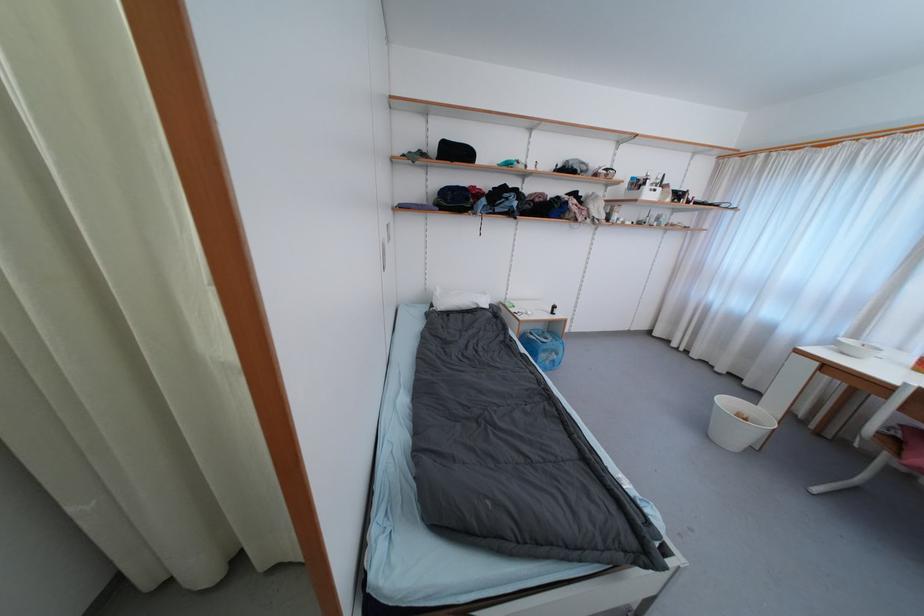
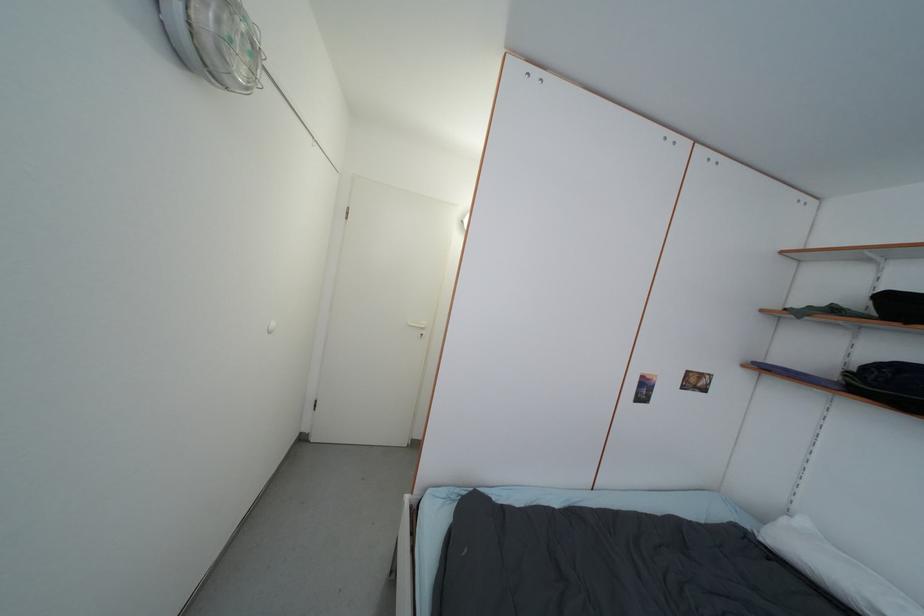
Question: The images are taken continuously from a first-person perspective. In which direction is your viewpoint rotating?

Choices:
 (A) Left
 (B) Right
 (C) Up
 (D) Down

Answer: (A)